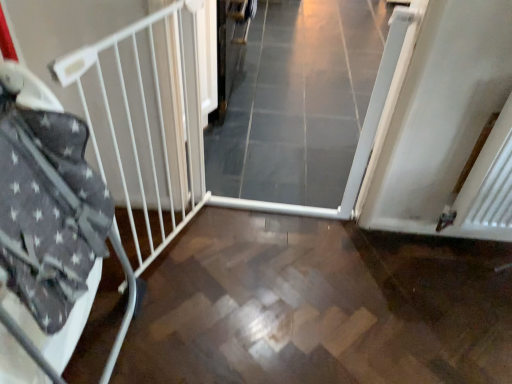
Question: In the image, is wooden floor at center on the left side or the right side of white metal bed frame at left?

Choices:
 (A) right
 (B) left

Answer: (A)

Question: From a real-world perspective, relative to white metal bed frame at left, is wooden floor at center vertically above or below?

Choices:
 (A) below
 (B) above

Answer: (A)

Question: Which of these objects is positioned farthest from the white metal bed frame at left?

Choices:
 (A) wooden floor at center
 (B) white glossy door at center

Answer: (B)

Question: Estimate the real-world distances between objects in this image. Which object is closer to the wooden floor at center?

Choices:
 (A) white glossy door at center
 (B) white metal bed frame at left

Answer: (B)